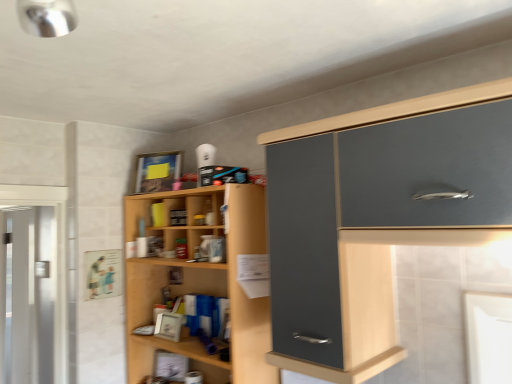
At what (x,y) coordinates should I click in order to perform the action: click on matte gray cabinet at upper right. Please return your answer as a coordinate pair (x, y). Looking at the image, I should click on (376, 217).

Where is `wooden shelves at center`? This screenshot has height=384, width=512. wooden shelves at center is located at coordinates (201, 282).

This screenshot has height=384, width=512. I want to click on matte gray cabinet at upper right, so click(x=376, y=217).

Would you say matte gray cabinet at upper right is a long distance from wooden shelves at center?

No, matte gray cabinet at upper right is not far from wooden shelves at center.

Consider the image. Between matte gray cabinet at upper right and wooden shelves at center, which one has larger size?

Bigger between the two is wooden shelves at center.

Between matte gray cabinet at upper right and wooden shelves at center, which one has less height?

matte gray cabinet at upper right is shorter.

From a real-world perspective, who is located lower, matte gray cabinet at upper right or wooden shelves at center?

From a 3D spatial view, wooden shelves at center is below.

Is wooden shelves at center wider than matte gray cabinet at upper right?

In fact, wooden shelves at center might be narrower than matte gray cabinet at upper right.

Would you consider wooden shelves at center to be distant from matte gray cabinet at upper right?

Actually, wooden shelves at center and matte gray cabinet at upper right are a little close together.

Which of these two, wooden shelves at center or matte gray cabinet at upper right, stands shorter?

matte gray cabinet at upper right.

Is wooden shelves at center facing away from matte gray cabinet at upper right?

No, wooden shelves at center's orientation is not away from matte gray cabinet at upper right.

From the image's perspective, is clear glass screen door at left located above or below wooden shelves at center?

clear glass screen door at left is below wooden shelves at center.

Considering the relative positions of clear glass screen door at left and wooden shelves at center in the image provided, is clear glass screen door at left to the right of wooden shelves at center from the viewer's perspective?

No, clear glass screen door at left is not to the right of wooden shelves at center.

From a real-world perspective, who is located lower, clear glass screen door at left or wooden shelves at center?

From a 3D spatial view, clear glass screen door at left is below.

This screenshot has height=384, width=512. Find the location of `cupboard in front of the clear glass screen door at left`. cupboard in front of the clear glass screen door at left is located at coordinates (201, 282).

Which point is more distant from viewer, (5, 257) or (317, 224)?

Point (5, 257)

Is clear glass screen door at left turned away from matte gray cabinet at upper right?

clear glass screen door at left is not turned away from matte gray cabinet at upper right.

Between clear glass screen door at left and matte gray cabinet at upper right, which one has smaller width?

clear glass screen door at left.

From the image's perspective, is clear glass screen door at left located above or below matte gray cabinet at upper right?

clear glass screen door at left is situated lower than matte gray cabinet at upper right in the image.

Where is `screen door that appears below the wooden shelves at center (from a real-world perspective)`? This screenshot has width=512, height=384. screen door that appears below the wooden shelves at center (from a real-world perspective) is located at coordinates (30, 295).

Is wooden shelves at center wider or thinner than clear glass screen door at left?

Clearly, wooden shelves at center has more width compared to clear glass screen door at left.

From a real-world perspective, which object rests below the other?

clear glass screen door at left.

In terms of size, does wooden shelves at center appear bigger or smaller than clear glass screen door at left?

Considering their sizes, wooden shelves at center takes up more space than clear glass screen door at left.

Which of these two, matte gray cabinet at upper right or clear glass screen door at left, is thinner?

With smaller width is clear glass screen door at left.

From the image's perspective, which object appears higher, matte gray cabinet at upper right or clear glass screen door at left?

matte gray cabinet at upper right appears higher in the image.

From a real-world perspective, which object stands above the other?

matte gray cabinet at upper right, from a real-world perspective.

In the scene shown: From their relative heights in the image, would you say matte gray cabinet at upper right is taller or shorter than clear glass screen door at left?

matte gray cabinet at upper right is shorter than clear glass screen door at left.

You are a GUI agent. You are given a task and a screenshot of the screen. Output one action in this format:
    pyautogui.click(x=<x>, y=<y>)
    Task: Click on the cabinetry located in front of the wooden shelves at center
    The height and width of the screenshot is (384, 512).
    Given the screenshot: What is the action you would take?
    pyautogui.click(x=376, y=217)

Where is `cupboard located underneath the matte gray cabinet at upper right (from a real-world perspective)`? The height and width of the screenshot is (384, 512). cupboard located underneath the matte gray cabinet at upper right (from a real-world perspective) is located at coordinates click(x=201, y=282).

Based on their spatial positions, is matte gray cabinet at upper right or clear glass screen door at left closer to wooden shelves at center?

Among the two, matte gray cabinet at upper right is located nearer to wooden shelves at center.

Estimate the real-world distances between objects in this image. Which object is closer to clear glass screen door at left, matte gray cabinet at upper right or wooden shelves at center?

wooden shelves at center is closer to clear glass screen door at left.

From the image, which object appears to be farther from matte gray cabinet at upper right, clear glass screen door at left or wooden shelves at center?

Among the two, clear glass screen door at left is located further to matte gray cabinet at upper right.

Based on their spatial positions, is wooden shelves at center or matte gray cabinet at upper right further from clear glass screen door at left?

The object further to clear glass screen door at left is matte gray cabinet at upper right.

Based on their spatial positions, is wooden shelves at center or clear glass screen door at left further from matte gray cabinet at upper right?

clear glass screen door at left lies further to matte gray cabinet at upper right than the other object.

Considering their positions, is clear glass screen door at left positioned closer to wooden shelves at center than matte gray cabinet at upper right?

matte gray cabinet at upper right lies closer to wooden shelves at center than the other object.

Image resolution: width=512 pixels, height=384 pixels. I want to click on cupboard located between clear glass screen door at left and matte gray cabinet at upper right in the left-right direction, so click(201, 282).